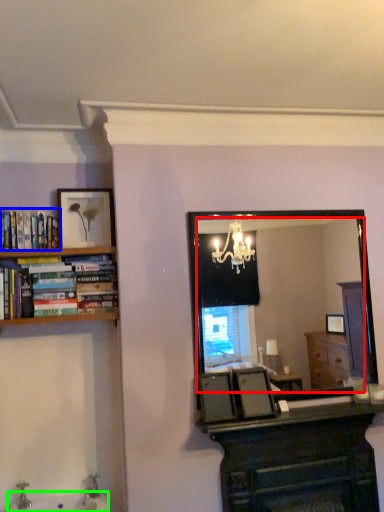
Question: Which object is the farthest from mirror (highlighted by a red box)? Choose among these: book (highlighted by a blue box) or sink (highlighted by a green box).

Choices:
 (A) book
 (B) sink

Answer: (B)